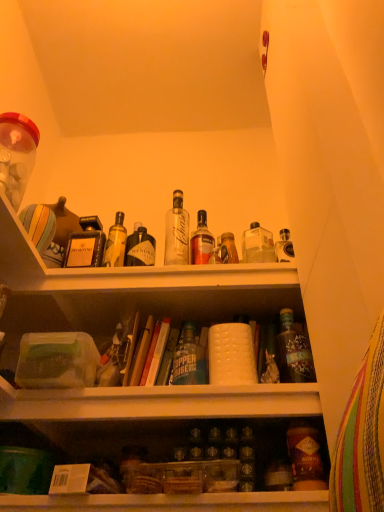
Question: Is matte brown bottle at lower right, acting as the 2th bottle starting from the right, surrounded by clear glass bottle at center, placed as the first bottle when sorted from left to right?

Choices:
 (A) no
 (B) yes

Answer: (A)

Question: From the image's perspective, is clear glass bottle at center, which ranks as the 5th bottle in right-to-left order, above matte brown bottle at lower right, acting as the 2th bottle starting from the right?

Choices:
 (A) no
 (B) yes

Answer: (B)

Question: Is clear glass bottle at center, placed as the first bottle when sorted from left to right, taller than matte brown bottle at lower right, acting as the 2th bottle starting from the right?

Choices:
 (A) no
 (B) yes

Answer: (B)

Question: Is clear glass bottle at center, which ranks as the 5th bottle in right-to-left order, not within matte brown bottle at lower right, acting as the 2th bottle starting from the right?

Choices:
 (A) yes
 (B) no

Answer: (A)

Question: Is clear glass bottle at center, which ranks as the 5th bottle in right-to-left order, not near matte brown bottle at lower right, arranged as the fourth bottle when viewed from the left?

Choices:
 (A) no
 (B) yes

Answer: (A)

Question: Does point (233, 248) appear closer or farther from the camera than point (187, 370)?

Choices:
 (A) closer
 (B) farther

Answer: (B)

Question: Considering the relative positions of translucent glass bottle at center, the third bottle in the left-to-right sequence, and green glass bottle at center, the 2th bottle when ordered from left to right, in the image provided, is translucent glass bottle at center, the third bottle in the left-to-right sequence, to the left or to the right of green glass bottle at center, the 2th bottle when ordered from left to right,?

Choices:
 (A) right
 (B) left

Answer: (A)

Question: Looking at their shapes, would you say translucent glass bottle at center, the third bottle in the left-to-right sequence, is wider or thinner than green glass bottle at center, the 4th bottle when ordered from right to left?

Choices:
 (A) thin
 (B) wide

Answer: (A)

Question: From a real-world perspective, is translucent glass bottle at center, the third bottle in the left-to-right sequence, physically located above or below green glass bottle at center, the 2th bottle when ordered from left to right?

Choices:
 (A) below
 (B) above

Answer: (B)

Question: Is translucent glass bottle at center, the 3th bottle when ordered from right to left, taller or shorter than hardcover book at center, positioned as the 2th book in left-to-right order?

Choices:
 (A) tall
 (B) short

Answer: (B)

Question: Considering the positions of point (236, 260) and point (147, 385), is point (236, 260) closer or farther from the camera than point (147, 385)?

Choices:
 (A) closer
 (B) farther

Answer: (B)

Question: In the image, is translucent glass bottle at center, the third bottle in the left-to-right sequence, positioned in front of or behind hardcover book at center, positioned as the 2th book in left-to-right order?

Choices:
 (A) front
 (B) behind

Answer: (B)

Question: Is translucent glass bottle at center, the third bottle in the left-to-right sequence, wider or thinner than hardcover book at center, positioned as the 2th book in left-to-right order?

Choices:
 (A) wide
 (B) thin

Answer: (B)

Question: Does point (150, 382) appear closer or farther from the camera than point (321, 475)?

Choices:
 (A) farther
 (B) closer

Answer: (A)

Question: Is hardcover book at center, the 1th book viewed from the right, bigger or smaller than matte brown bottle at lower right, acting as the 2th bottle starting from the right?

Choices:
 (A) small
 (B) big

Answer: (B)